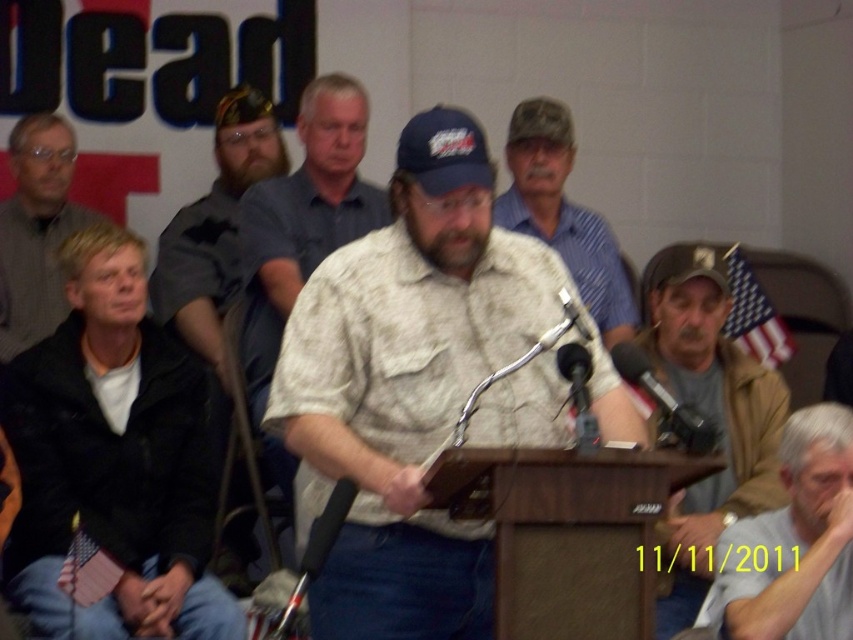
You are organizing a photo shoot and need to know which object is wider between the gray knit sweater at left and the black metallic microphone at right. Can you determine this based on the scene?

The gray knit sweater at left is wider than the black metallic microphone at right.